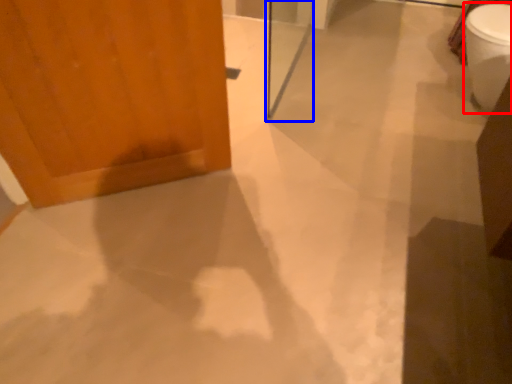
Question: Which object appears closest to the camera in this image, toilet bowl (highlighted by a red box) or screen door (highlighted by a blue box)?

Choices:
 (A) toilet bowl
 (B) screen door

Answer: (B)